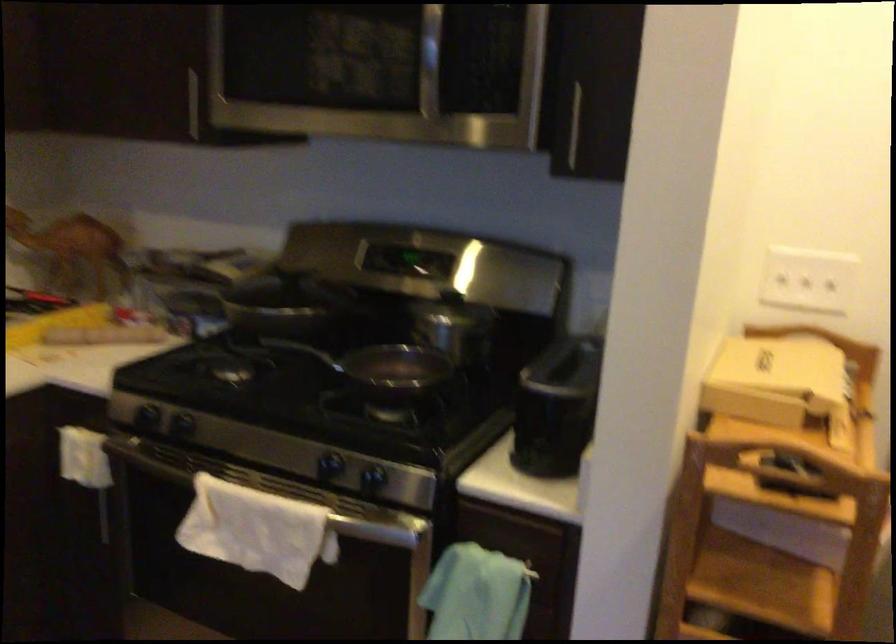
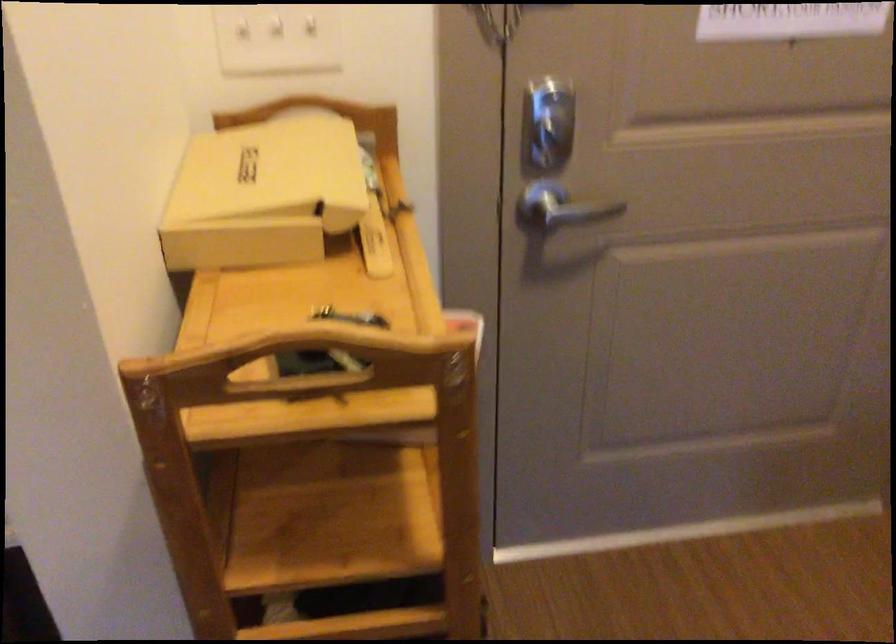
Locate, in the second image, the point that corresponds to (810,281) in the first image.

(276, 39)